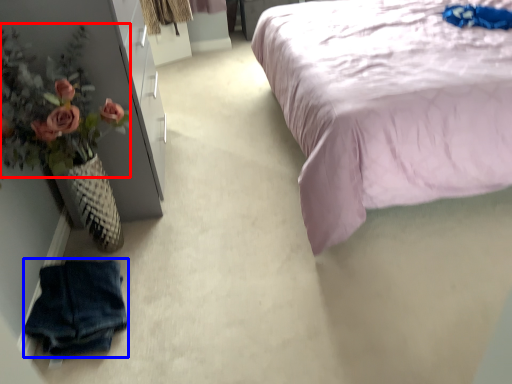
Question: Which of the following is the closest to the observer, floral arrangement (highlighted by a red box) or clothing (highlighted by a blue box)?

Choices:
 (A) floral arrangement
 (B) clothing

Answer: (B)